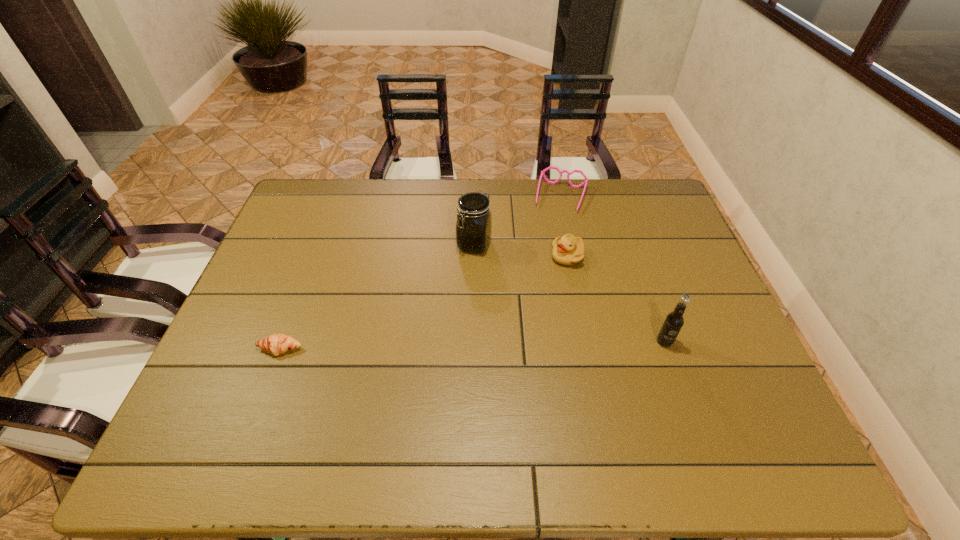
This screenshot has height=540, width=960. I want to click on free region located on the lid of the jar, so click(x=446, y=312).

The width and height of the screenshot is (960, 540). I want to click on vacant position located on the arms of the second shortest object, so click(x=540, y=274).

Find the location of a particular element. The height and width of the screenshot is (540, 960). vacant region located on the arms of the second shortest object is located at coordinates (543, 265).

Find the location of a particular element. The image size is (960, 540). free space located on the arms of the second shortest object is located at coordinates (547, 249).

Identify the location of vacant area located on the front-facing side of the third shortest object. The width and height of the screenshot is (960, 540). (510, 308).

This screenshot has width=960, height=540. I want to click on free location located on the front-facing side of the third shortest object, so click(505, 312).

Where is `free space located 0.310m on the front-facing side of the third shortest object`? This screenshot has height=540, width=960. free space located 0.310m on the front-facing side of the third shortest object is located at coordinates (487, 328).

Image resolution: width=960 pixels, height=540 pixels. I want to click on object located at the far edge, so point(585,182).

Locate an element on the screen. Image resolution: width=960 pixels, height=540 pixels. object that is at the left edge is located at coordinates (275, 344).

Find the location of a particular element. object that is positioned at the right edge is located at coordinates (673, 322).